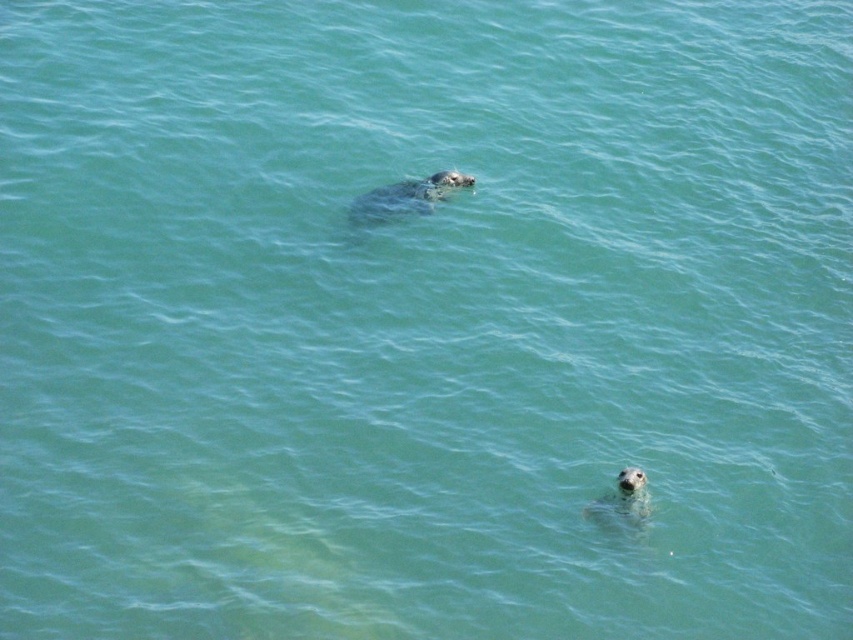
Is gray fur seal at upper center positioned in front of gray matte seal at lower center?

No, it is behind gray matte seal at lower center.

Which of these two, gray fur seal at upper center or gray matte seal at lower center, stands shorter?

gray fur seal at upper center is shorter.

This screenshot has height=640, width=853. Find the location of `gray fur seal at upper center`. gray fur seal at upper center is located at coordinates (405, 196).